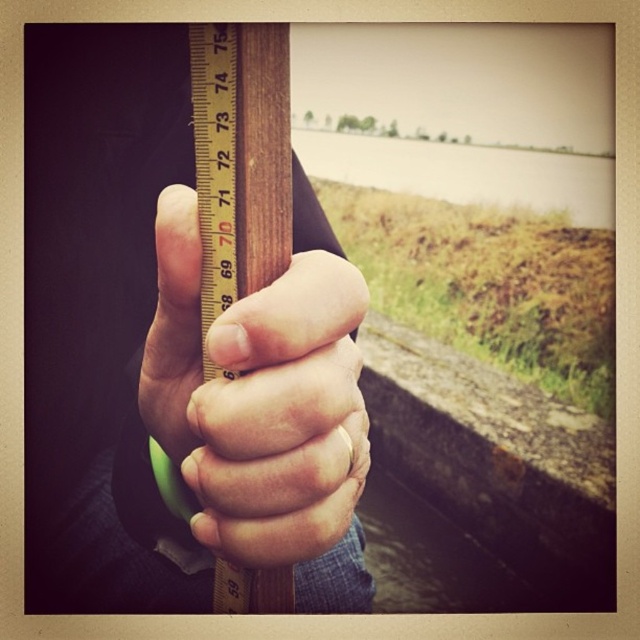
Question: Which of these objects is positioned closest to the matte wood ruler at center?

Choices:
 (A) matte wood hand at center
 (B) wooden ruler at center

Answer: (A)

Question: In this image, where is matte wood ruler at center located relative to wooden ruler at center?

Choices:
 (A) right
 (B) left

Answer: (B)

Question: Can you confirm if matte wood hand at center is bigger than wooden ruler at center?

Choices:
 (A) no
 (B) yes

Answer: (B)

Question: Estimate the real-world distances between objects in this image. Which object is closer to the wooden ruler at center?

Choices:
 (A) matte wood ruler at center
 (B) matte wood hand at center

Answer: (B)

Question: Which point appears farthest from the camera in this image?

Choices:
 (A) (280, 170)
 (B) (212, 484)

Answer: (A)

Question: Does matte wood ruler at center come behind matte wood hand at center?

Choices:
 (A) no
 (B) yes

Answer: (B)